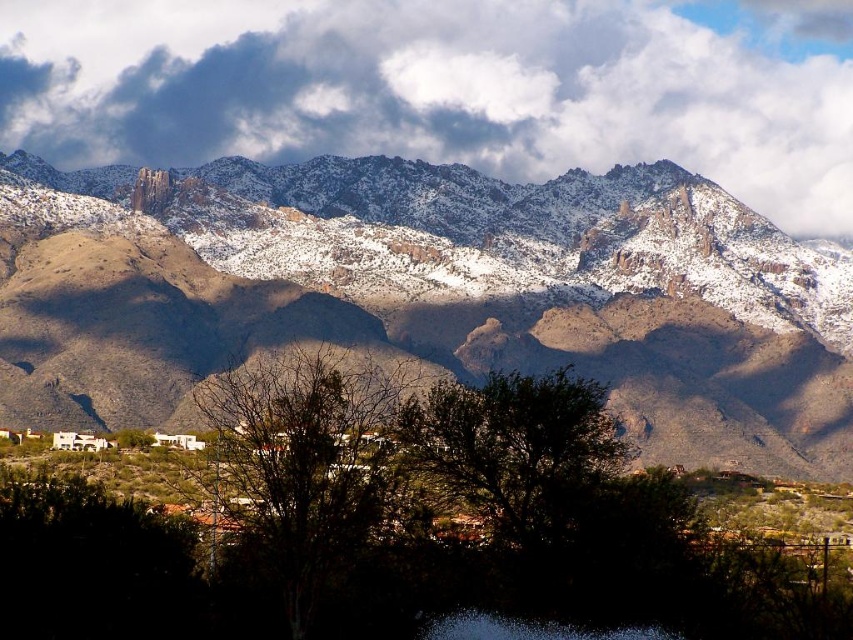
You are a hiker planning to reach the highest point in the mountain range shown in the image. You see the snow covered rock at upper center marked by point (430, 292). Is this point the highest elevation in the scene?

The snow covered rock at upper center marked by point (430, 292) is the highest elevation in the scene because it is the highest point depicted in the image.